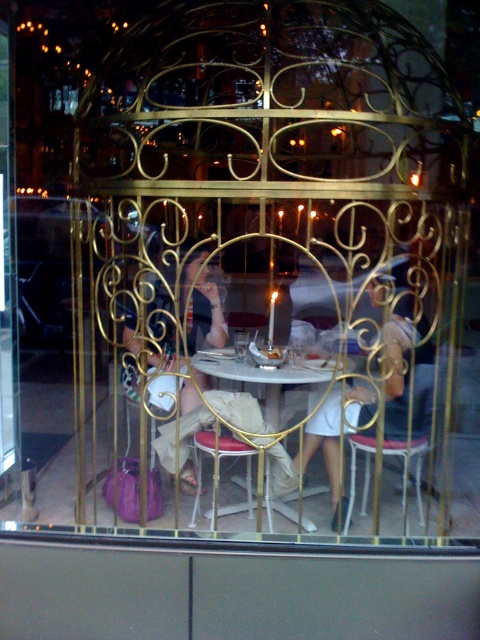
You are a customer at the cafe and want to sit down. There is a smooth leather chair at center and a white glossy table at center. Which object should you approach first to sit properly?

The smooth leather chair at center is in front of the white glossy table at center, so you should approach the smooth leather chair at center first to sit properly.

You are standing at the entrance of the cafe and want to take a photo of the point at coordinates point (159, 368). If your camera has a focal length of 50mm and you are currently 4 meters away from the point, should you move closer or farther away to focus properly?

The point (159, 368) is 3.64 meters away from the camera. Since you are currently 4 meters away, you need to move closer to 3.64 meters to focus properly.